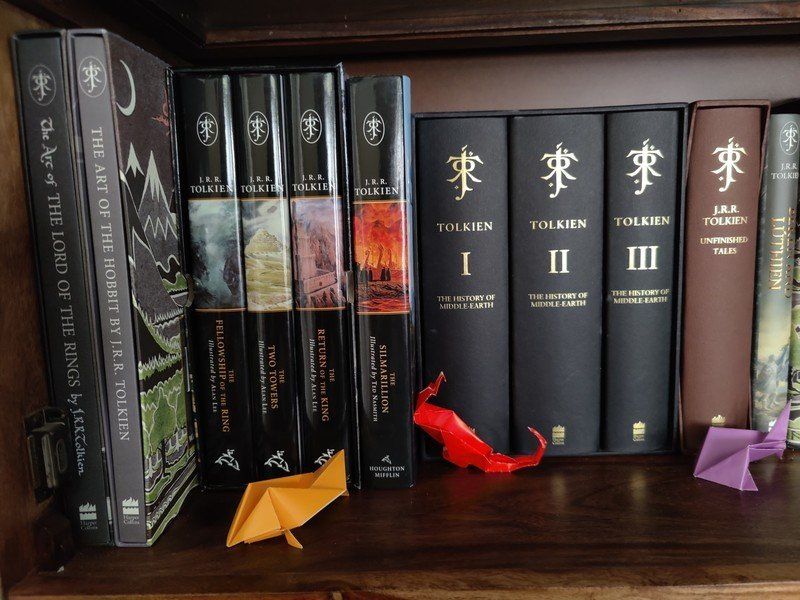
Find the location of a particular element. The image size is (800, 600). door latch is located at coordinates (54, 459).